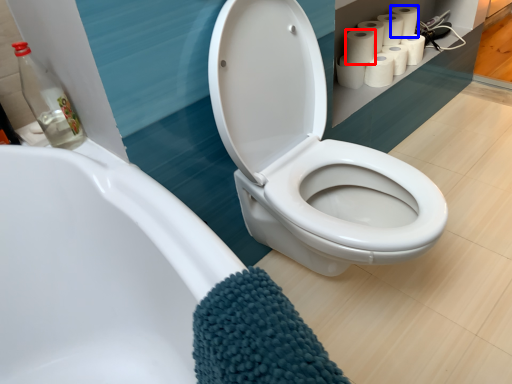
Question: Which object is closer to the camera taking this photo, paper towel (highlighted by a red box) or toilet paper (highlighted by a blue box)?

Choices:
 (A) paper towel
 (B) toilet paper

Answer: (A)